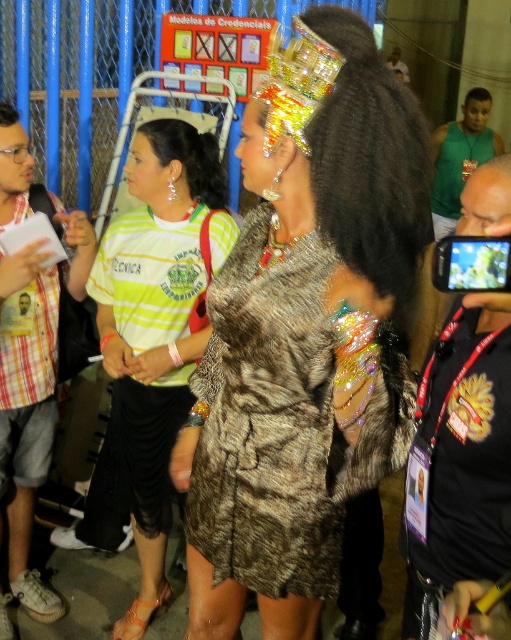
Is green striped shirt at center wider than plaid cotton shirt at left?

Yes.

Looking at this image, between green striped shirt at center and plaid cotton shirt at left, which one is positioned lower?

Positioned lower is green striped shirt at center.

Who is more forward, (121,484) or (12,448)?

Positioned in front is point (12,448).

This screenshot has width=511, height=640. I want to click on green striped shirt at center, so click(151, 342).

Is shiny black phone at right bigger than plaid cotton shirt at left?

→ Incorrect, shiny black phone at right is not larger than plaid cotton shirt at left.

Which is more to the left, shiny black phone at right or plaid cotton shirt at left?

plaid cotton shirt at left is more to the left.

Image resolution: width=511 pixels, height=640 pixels. What do you see at coordinates (459, 460) in the screenshot? I see `shiny black phone at right` at bounding box center [459, 460].

Where is `shiny black phone at right`? This screenshot has height=640, width=511. shiny black phone at right is located at coordinates (459, 460).

The height and width of the screenshot is (640, 511). Describe the element at coordinates (459, 460) in the screenshot. I see `shiny black phone at right` at that location.

The width and height of the screenshot is (511, 640). What are the coordinates of `shiny black phone at right` in the screenshot? It's located at (459, 460).